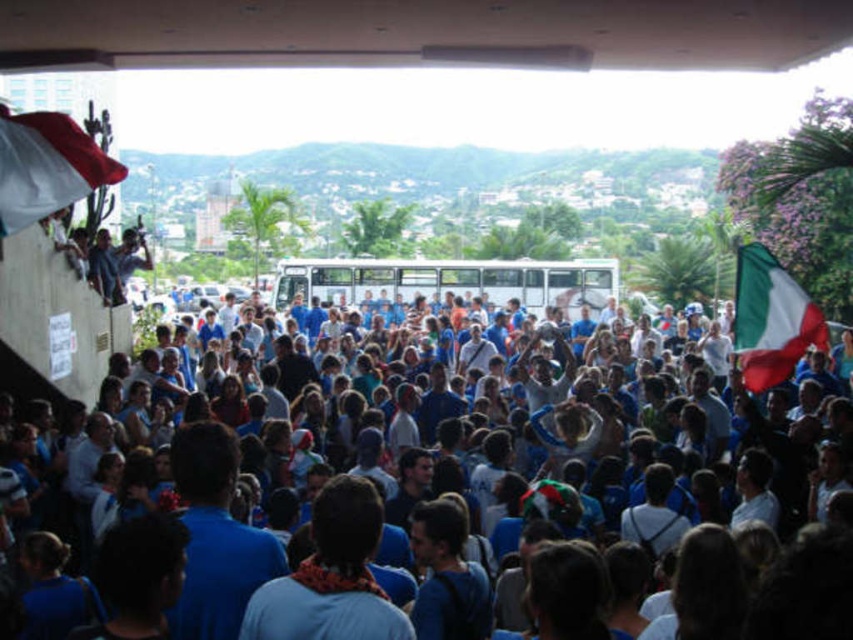
You are a GUI agent. You are given a task and a screenshot of the screen. Output one action in this format:
    pyautogui.click(x=<x>, y=<y>)
    Task: Click on the blue fabric crowd at center
    This screenshot has width=853, height=640.
    Given the screenshot: What is the action you would take?
    pyautogui.click(x=659, y=435)

Is point (669, 442) more distant than point (819, 332)?

No.

Identify the location of blue fabric crowd at center. (659, 435).

Between white fabric flag at upper left and green and white fabric flag at right, which one has less height?

With less height is white fabric flag at upper left.

Who is positioned more to the left, white fabric flag at upper left or green and white fabric flag at right?

white fabric flag at upper left is more to the left.

Who is more distant from viewer, (50,132) or (741,289)?

The point (741,289) is behind.

You are a GUI agent. You are given a task and a screenshot of the screen. Output one action in this format:
    pyautogui.click(x=<x>, y=<y>)
    Task: Click on the white fabric flag at upper left
    
    Given the screenshot: What is the action you would take?
    pyautogui.click(x=47, y=166)

Can you confirm if blue fabric crowd at center is positioned to the left of white fabric flag at upper left?

Incorrect, blue fabric crowd at center is not on the left side of white fabric flag at upper left.

Who is lower down, blue fabric crowd at center or white fabric flag at upper left?

blue fabric crowd at center is below.

Is point (421, 378) farther from camera compared to point (44, 205)?

Yes.

In order to click on blue fabric crowd at center in this screenshot , I will do `click(659, 435)`.